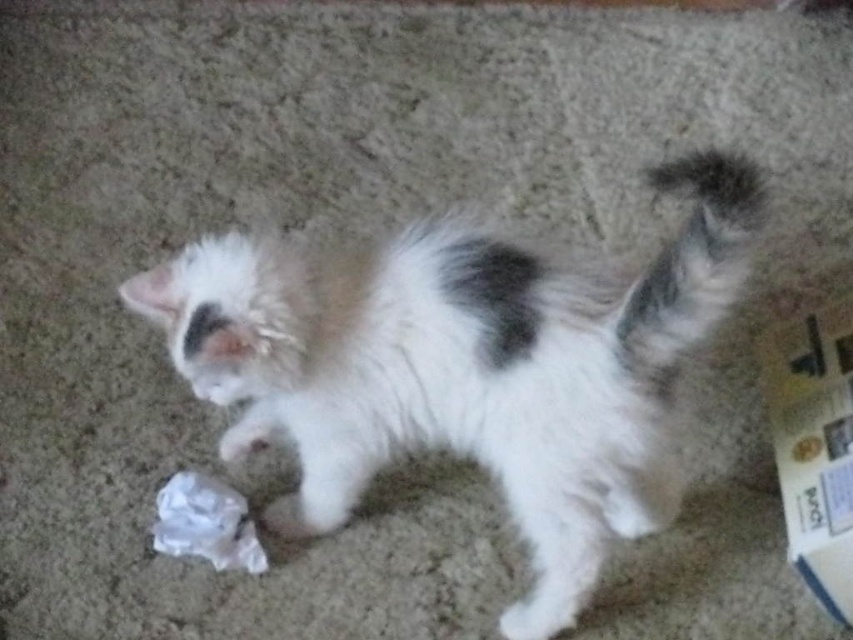
Question: Is white fluffy cat at center bigger than fluffy white tail at upper right?

Choices:
 (A) no
 (B) yes

Answer: (B)

Question: Does white fluffy cat at center come behind fluffy white tail at upper right?

Choices:
 (A) no
 (B) yes

Answer: (B)

Question: Can you confirm if white fluffy cat at center is smaller than fluffy white tail at upper right?

Choices:
 (A) no
 (B) yes

Answer: (A)

Question: Which point is closer to the camera taking this photo?

Choices:
 (A) (706, 262)
 (B) (680, 289)

Answer: (A)

Question: Which of the following is the closest to the observer?

Choices:
 (A) (717, 298)
 (B) (192, 508)

Answer: (A)

Question: Which of the following is the farthest from the observer?

Choices:
 (A) white crumpled plastic at lower left
 (B) white fluffy cat at center
 (C) fluffy white tail at upper right

Answer: (A)